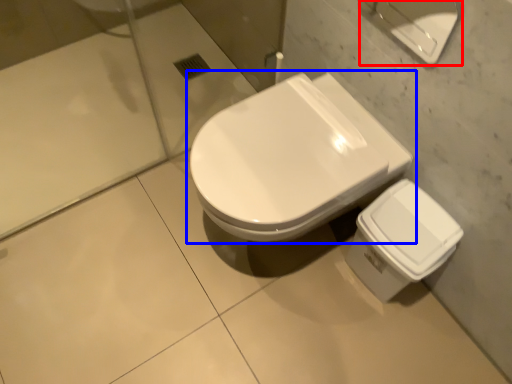
Question: Among these objects, which one is farthest to the camera, porcelain (highlighted by a red box) or toilet (highlighted by a blue box)?

Choices:
 (A) porcelain
 (B) toilet

Answer: (B)